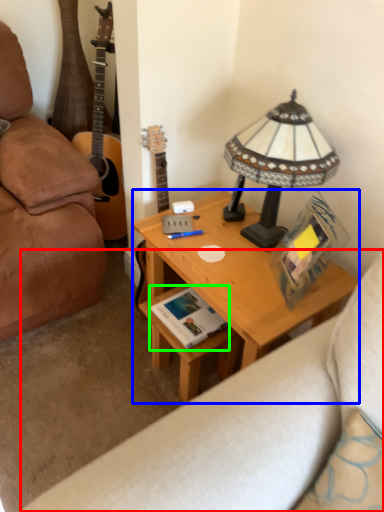
Question: Based on their relative distances, which object is farther from studio couch (highlighted by a red box)? Choose from desk (highlighted by a blue box) and book (highlighted by a green box).

Choices:
 (A) desk
 (B) book

Answer: (B)